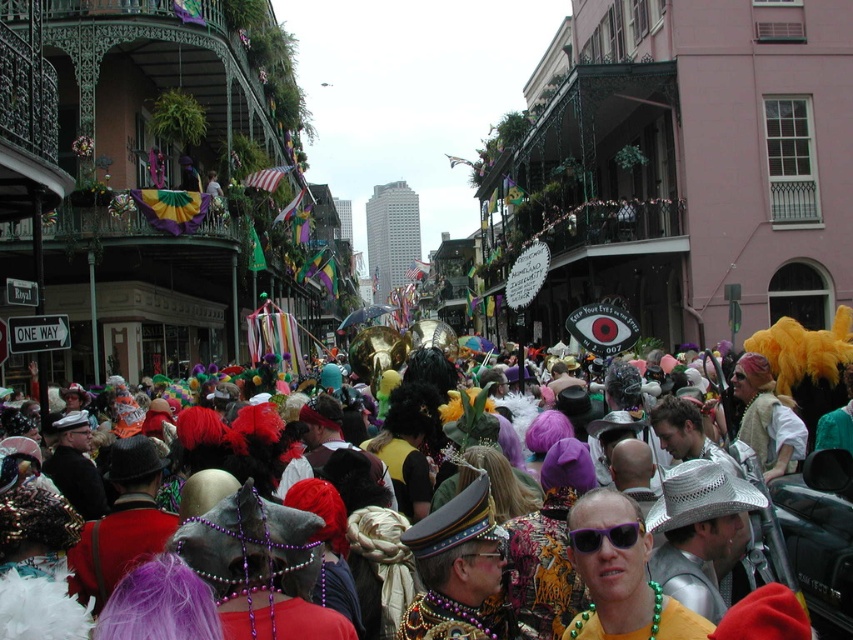
Based on the photo, you are a photographer at the Mardi Gras parade. You want to capture a photo of both the multicolored feathers at center and the purple plastic sunglasses at center in the same frame. Which object should you focus on first to ensure both are in the frame?

The multicolored feathers at center is above the purple plastic sunglasses at center, so you should focus on the purple plastic sunglasses at center first to ensure both are in the frame.

You are a photographer standing in the crowd at the Mardi Gras parade. You want to capture a photo that includes both the shiny gold necklace at center and the purple plastic sunglasses at center. The minimum distance between the two items in your camera frame must be at least 5 feet to ensure clarity. Based on their positions, can you fit both items in the frame without them overlapping?

The shiny gold necklace at center is 4.33 feet from the purple plastic sunglasses at center. Since the required minimum distance is 5 feet, the items are too close to fit without overlapping in the frame.